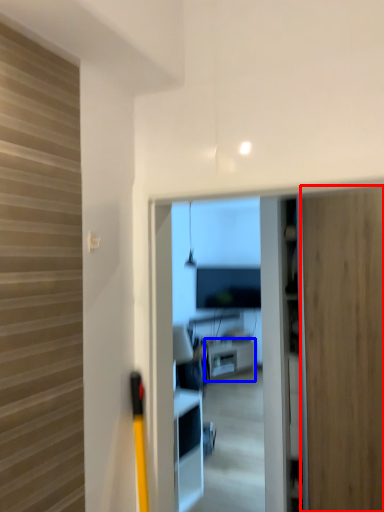
Question: Among these objects, which one is farthest to the camera, door (highlighted by a red box) or furniture (highlighted by a blue box)?

Choices:
 (A) door
 (B) furniture

Answer: (B)